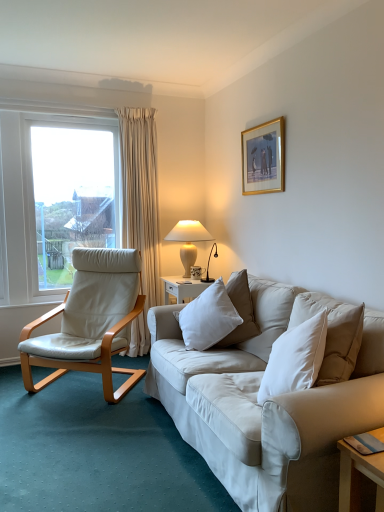
Question: From the image's perspective, would you say white leather chair at left is shown under white ceramic table lamp at upper right?

Choices:
 (A) yes
 (B) no

Answer: (A)

Question: From a real-world perspective, is white leather chair at left on top of white ceramic table lamp at upper right?

Choices:
 (A) yes
 (B) no

Answer: (B)

Question: From a real-world perspective, is white leather chair at left physically below white ceramic table lamp at upper right?

Choices:
 (A) yes
 (B) no

Answer: (A)

Question: Considering the relative positions of white leather chair at left and white ceramic table lamp at upper right in the image provided, is white leather chair at left to the right of white ceramic table lamp at upper right from the viewer's perspective?

Choices:
 (A) yes
 (B) no

Answer: (B)

Question: Is white leather chair at left wider than white ceramic table lamp at upper right?

Choices:
 (A) yes
 (B) no

Answer: (A)

Question: From the image's perspective, is white leather chair at left located above white ceramic table lamp at upper right?

Choices:
 (A) yes
 (B) no

Answer: (B)

Question: Is white leather chair at left next to gold/glossy picture frame at upper center?

Choices:
 (A) no
 (B) yes

Answer: (A)

Question: Can you confirm if white leather chair at left is thinner than gold/glossy picture frame at upper center?

Choices:
 (A) no
 (B) yes

Answer: (A)

Question: From the image's perspective, is white leather chair at left located above gold/glossy picture frame at upper center?

Choices:
 (A) yes
 (B) no

Answer: (B)

Question: Is white leather chair at left bigger than gold/glossy picture frame at upper center?

Choices:
 (A) yes
 (B) no

Answer: (A)

Question: Is the position of white leather chair at left more distant than that of gold/glossy picture frame at upper center?

Choices:
 (A) no
 (B) yes

Answer: (A)

Question: Is white leather chair at left not within gold/glossy picture frame at upper center?

Choices:
 (A) no
 (B) yes

Answer: (B)

Question: From a real-world perspective, is white ceramic table lamp at upper right beneath white soft pillow at center?

Choices:
 (A) yes
 (B) no

Answer: (B)